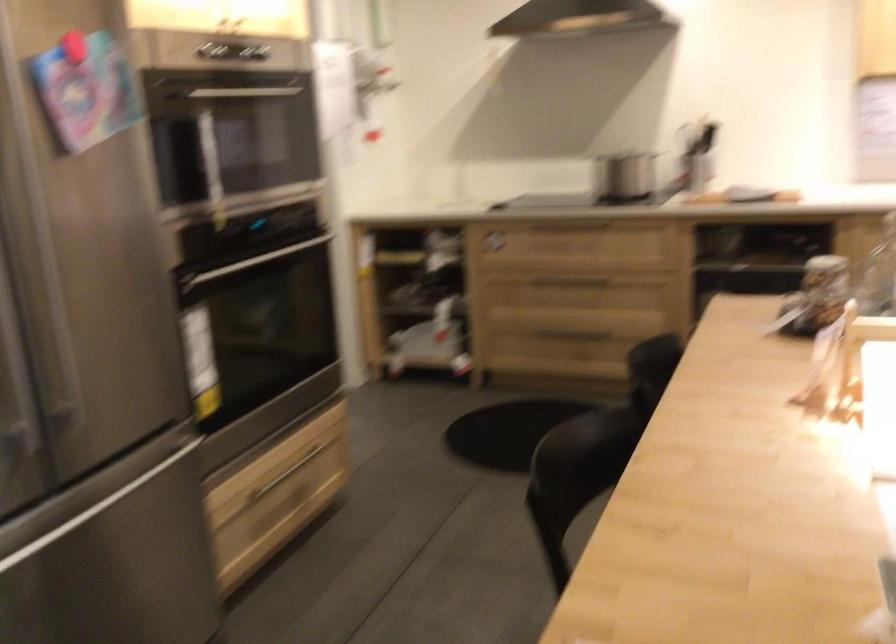
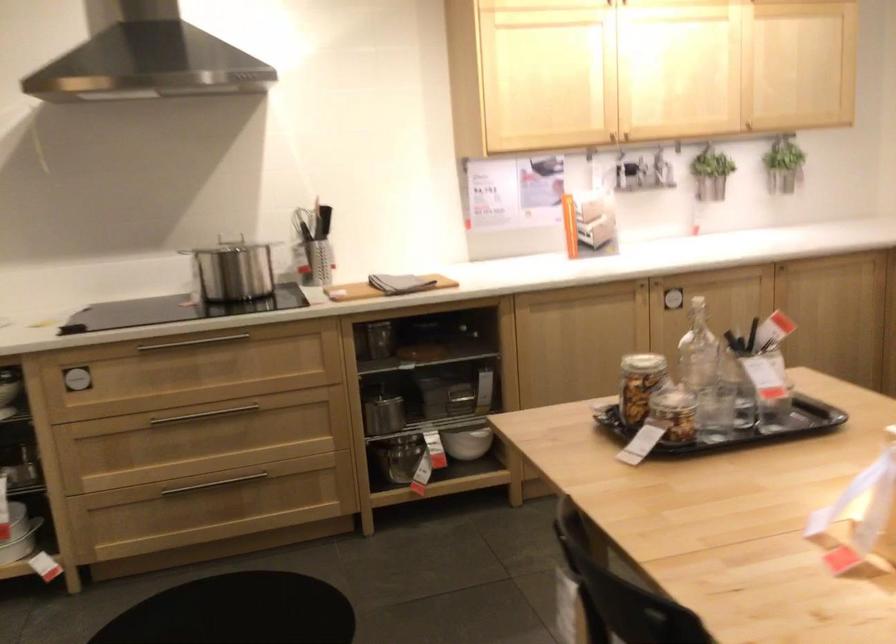
Find the pixel in the second image that matches point (574, 325) in the first image.

(213, 484)